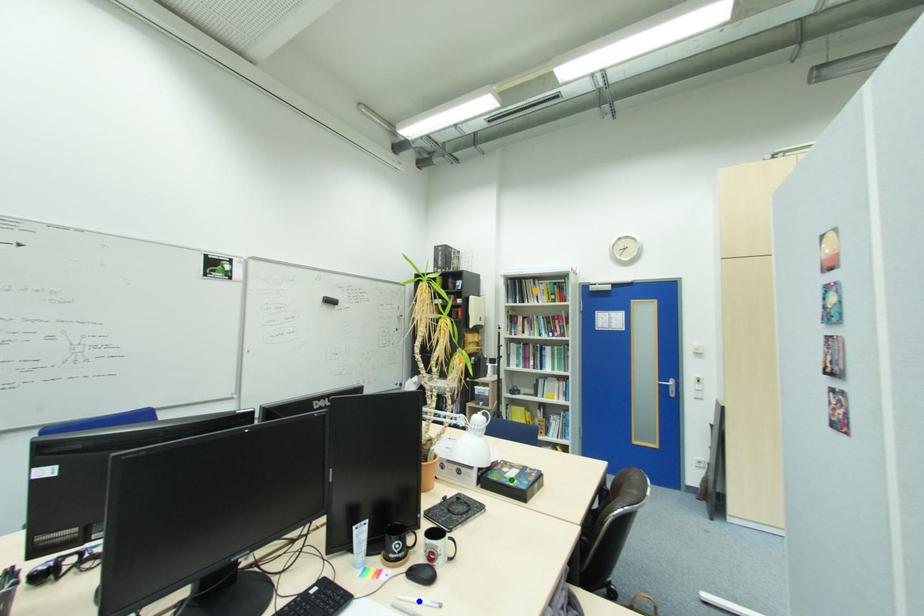
Order these from nearest to farthest:
- orange point
- blue point
- green point

orange point
green point
blue point